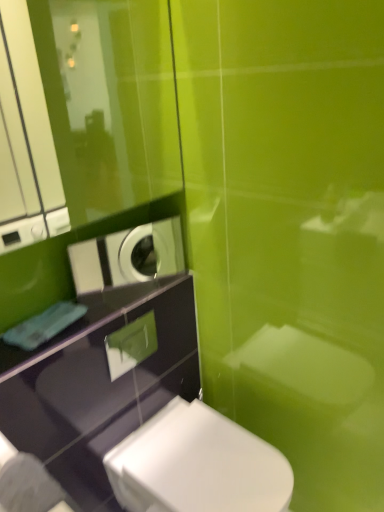
Question: Is white glossy toilet at lower center not near white glossy washing machine at upper left?

Choices:
 (A) no
 (B) yes

Answer: (A)

Question: From the image's perspective, is white glossy toilet at lower center below white glossy washing machine at upper left?

Choices:
 (A) no
 (B) yes

Answer: (B)

Question: Does white glossy toilet at lower center have a lesser height compared to white glossy washing machine at upper left?

Choices:
 (A) yes
 (B) no

Answer: (B)

Question: Does white glossy toilet at lower center appear on the left side of white glossy washing machine at upper left?

Choices:
 (A) yes
 (B) no

Answer: (B)

Question: Is white glossy washing machine at upper left completely or partially inside white glossy toilet at lower center?

Choices:
 (A) yes
 (B) no

Answer: (B)

Question: Is white glossy toilet at lower center taller than white glossy washing machine at upper left?

Choices:
 (A) yes
 (B) no

Answer: (A)

Question: Can you confirm if white glossy washing machine at upper left is shorter than white glossy toilet at lower center?

Choices:
 (A) no
 (B) yes

Answer: (B)

Question: Does white glossy washing machine at upper left touch white glossy toilet at lower center?

Choices:
 (A) no
 (B) yes

Answer: (A)

Question: Considering the relative positions of white glossy washing machine at upper left and white glossy toilet at lower center in the image provided, is white glossy washing machine at upper left to the left of white glossy toilet at lower center from the viewer's perspective?

Choices:
 (A) yes
 (B) no

Answer: (A)

Question: Is white glossy washing machine at upper left not close to white glossy toilet at lower center?

Choices:
 (A) yes
 (B) no

Answer: (B)

Question: From the image's perspective, would you say white glossy washing machine at upper left is shown under white glossy toilet at lower center?

Choices:
 (A) no
 (B) yes

Answer: (A)

Question: Can white glossy toilet at lower center be found inside white glossy washing machine at upper left?

Choices:
 (A) no
 (B) yes

Answer: (A)

Question: Relative to white glossy washing machine at upper left, is white glossy toilet at lower center in front or behind?

Choices:
 (A) front
 (B) behind

Answer: (A)